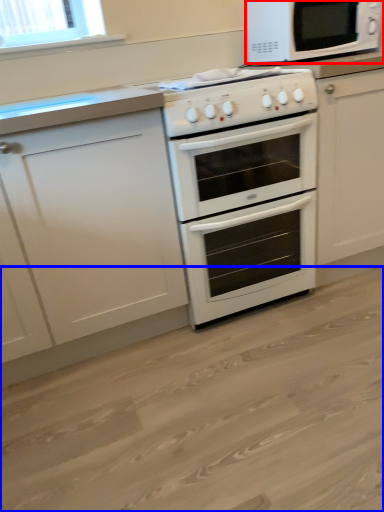
Question: Which point is further to the camera, microwave oven (highlighted by a red box) or plain (highlighted by a blue box)?

Choices:
 (A) microwave oven
 (B) plain

Answer: (A)